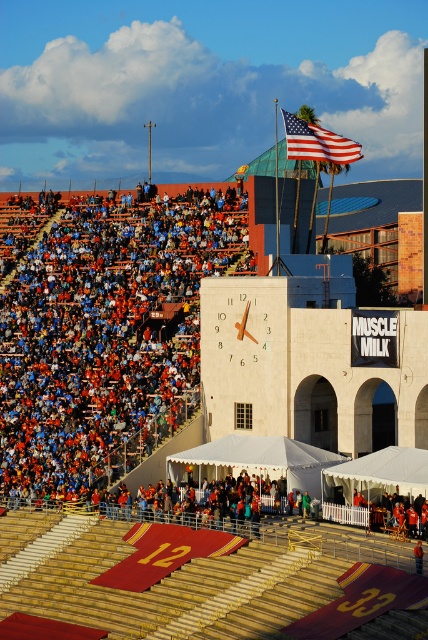
Who is taller, orange fabric seats at upper left or american flag at upper center?

american flag at upper center

Which is above, orange fabric seats at upper left or american flag at upper center?

american flag at upper center is above.

Does point (149, 257) lie behind point (297, 129)?

That is True.

The image size is (428, 640). I want to click on orange fabric seats at upper left, so click(x=107, y=333).